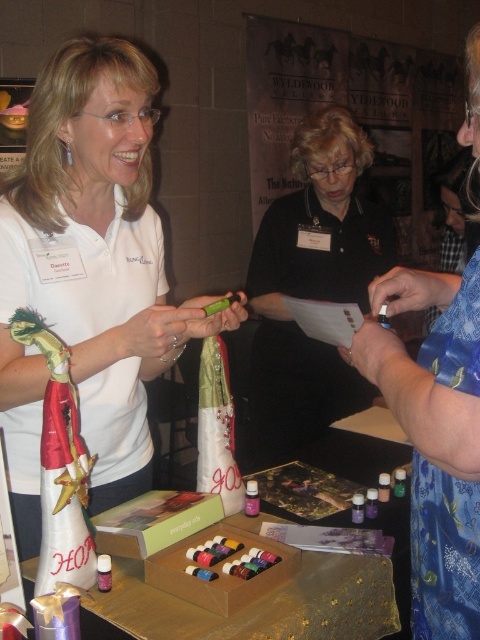
You are setting up for an event and need to place a decorative item on the wooden table at center. The translucent plastic bottle at center is already placed there. Considering the table size, will the bottle fit comfortably without overcrowding the table?

The wooden table at center is wider than the translucent plastic bottle at center, so there should be enough space for the decorative item alongside the bottle without overcrowding.

You are organizing a photoshoot and need to ensure that the white matte shirt at center and the blue floral dress at center fit within a 1.5 meter wide backdrop. Based on their widths, will both items fit side by side?

The white matte shirt at center might be wider than blue floral dress at center, so it is uncertain if both will fit within the 1.5 meter backdrop without overlapping. Measure their actual widths to confirm.